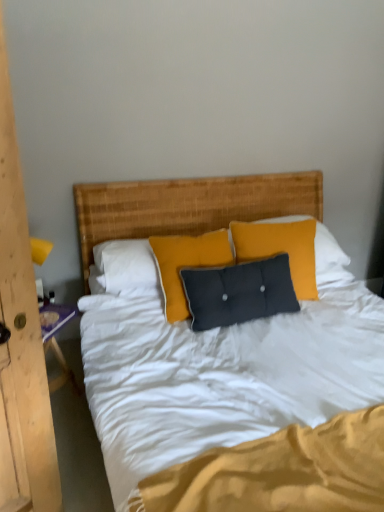
Question: Considering the positions of wooden nightstand at left and velvet dark gray pillow at center in the image, is wooden nightstand at left taller or shorter than velvet dark gray pillow at center?

Choices:
 (A) tall
 (B) short

Answer: (B)

Question: Is wooden nightstand at left in front of or behind velvet dark gray pillow at center in the image?

Choices:
 (A) behind
 (B) front

Answer: (B)

Question: From a real-world perspective, is wooden nightstand at left physically located above or below velvet dark gray pillow at center?

Choices:
 (A) below
 (B) above

Answer: (A)

Question: From their relative heights in the image, would you say velvet dark gray pillow at center is taller or shorter than wooden nightstand at left?

Choices:
 (A) tall
 (B) short

Answer: (A)

Question: Looking at their shapes, would you say velvet dark gray pillow at center is wider or thinner than wooden nightstand at left?

Choices:
 (A) thin
 (B) wide

Answer: (A)

Question: In the image, is velvet dark gray pillow at center positioned in front of or behind wooden nightstand at left?

Choices:
 (A) behind
 (B) front

Answer: (A)

Question: Is velvet dark gray pillow at center inside or outside of wooden nightstand at left?

Choices:
 (A) outside
 (B) inside

Answer: (A)